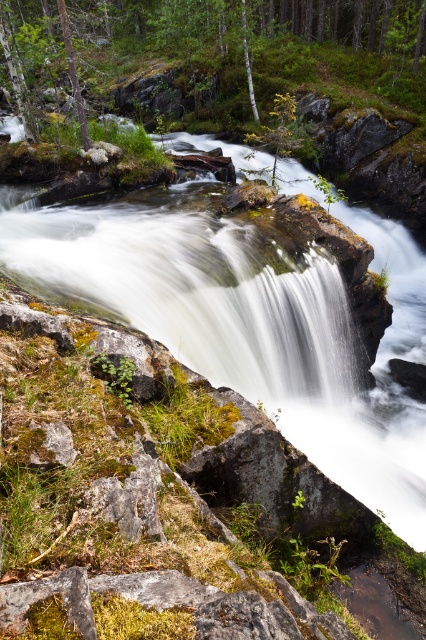
Question: Can you confirm if white smooth water at center is thinner than green mossy rock at upper center?

Choices:
 (A) yes
 (B) no

Answer: (A)

Question: Which object is closer to the camera taking this photo?

Choices:
 (A) white smooth water at center
 (B) green mossy rock at upper center
 (C) white smooth tree at center

Answer: (A)

Question: Where is green mossy rock at upper center located in relation to white smooth tree at center in the image?

Choices:
 (A) left
 (B) right

Answer: (A)

Question: Which point appears closest to the camera in this image?

Choices:
 (A) (249, 72)
 (B) (322, 38)
 (C) (385, 518)

Answer: (C)

Question: Can you confirm if green mossy rock at upper center is thinner than white smooth tree at center?

Choices:
 (A) yes
 (B) no

Answer: (B)

Question: Which object appears closest to the camera in this image?

Choices:
 (A) white smooth tree at center
 (B) white smooth water at center

Answer: (B)